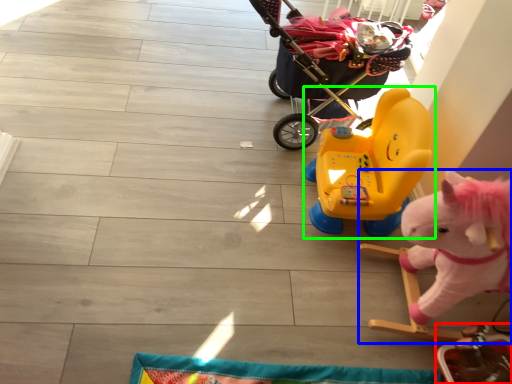
Question: Considering the real-world distances, which object is farthest from toy (highlighted by a red box)? toy (highlighted by a blue box) or toy (highlighted by a green box)?

Choices:
 (A) toy
 (B) toy

Answer: (B)